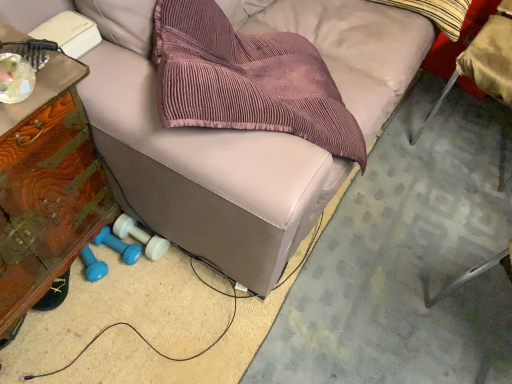
Question: Can you confirm if blue rubber dumbbell at lower left, the 2th dumbbell in the left-to-right sequence, is bigger than striped cotton throw pillow at upper right?

Choices:
 (A) no
 (B) yes

Answer: (A)

Question: Is blue rubber dumbbell at lower left, arranged as the 1th dumbbell when viewed from the right, placed right next to striped cotton throw pillow at upper right?

Choices:
 (A) no
 (B) yes

Answer: (A)

Question: Is blue rubber dumbbell at lower left, the 2th dumbbell in the left-to-right sequence, not within striped cotton throw pillow at upper right?

Choices:
 (A) yes
 (B) no

Answer: (A)

Question: Is striped cotton throw pillow at upper right located within blue rubber dumbbell at lower left, arranged as the 1th dumbbell when viewed from the right?

Choices:
 (A) no
 (B) yes

Answer: (A)

Question: Is blue rubber dumbbell at lower left, the 2th dumbbell in the left-to-right sequence, positioned with its back to striped cotton throw pillow at upper right?

Choices:
 (A) yes
 (B) no

Answer: (B)

Question: Is wooden side table at left, the first furniture in the left-to-right sequence, wider or thinner than leather couch at center, arranged as the first furniture when viewed from the right?

Choices:
 (A) thin
 (B) wide

Answer: (A)

Question: In terms of height, does wooden side table at left, the second furniture positioned from the right, look taller or shorter compared to leather couch at center, arranged as the first furniture when viewed from the right?

Choices:
 (A) short
 (B) tall

Answer: (A)

Question: From a real-world perspective, is wooden side table at left, the second furniture positioned from the right, physically located above or below leather couch at center, which is the second furniture from left to right?

Choices:
 (A) below
 (B) above

Answer: (A)

Question: Is point (0, 211) positioned closer to the camera than point (123, 147)?

Choices:
 (A) closer
 (B) farther

Answer: (A)

Question: Visually, is striped cotton throw pillow at upper right positioned to the left or to the right of leather couch at center, which is the second furniture from left to right?

Choices:
 (A) right
 (B) left

Answer: (A)

Question: Considering their positions, is striped cotton throw pillow at upper right located in front of or behind leather couch at center, which is the second furniture from left to right?

Choices:
 (A) front
 (B) behind

Answer: (B)

Question: Is striped cotton throw pillow at upper right taller or shorter than leather couch at center, arranged as the first furniture when viewed from the right?

Choices:
 (A) tall
 (B) short

Answer: (B)

Question: Considering the positions of striped cotton throw pillow at upper right and leather couch at center, arranged as the first furniture when viewed from the right, in the image, is striped cotton throw pillow at upper right wider or thinner than leather couch at center, arranged as the first furniture when viewed from the right,?

Choices:
 (A) wide
 (B) thin

Answer: (B)

Question: From their relative heights in the image, would you say metallic silver chair at lower right is taller or shorter than blue rubber dumbbell at lower left, which is the first dumbbell in left-to-right order?

Choices:
 (A) tall
 (B) short

Answer: (A)

Question: Considering the relative positions of metallic silver chair at lower right and blue rubber dumbbell at lower left, acting as the 2th dumbbell starting from the right, in the image provided, is metallic silver chair at lower right to the left or to the right of blue rubber dumbbell at lower left, acting as the 2th dumbbell starting from the right,?

Choices:
 (A) right
 (B) left

Answer: (A)